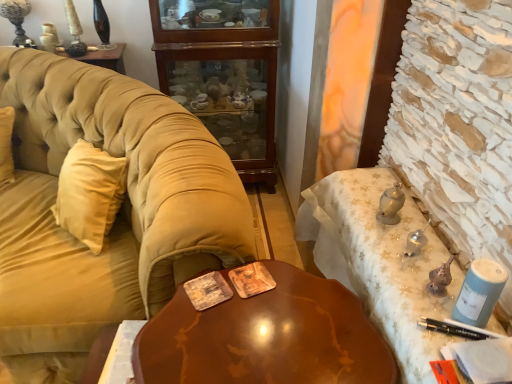
Question: From a real-world perspective, is velvet beige couch at left above or below glossy wood table at center?

Choices:
 (A) above
 (B) below

Answer: (A)

Question: Is velvet beige couch at left bigger or smaller than glossy wood table at center?

Choices:
 (A) small
 (B) big

Answer: (B)

Question: Which is nearer to the glossy wood table at center?

Choices:
 (A) velvet beige couch at left
 (B) metallic silver desk at right
 (C) mahogany wood cabinet at center

Answer: (B)

Question: Estimate the real-world distances between objects in this image. Which object is closer to the glossy wood table at center?

Choices:
 (A) mahogany wood cabinet at center
 (B) velvet beige couch at left
 (C) metallic silver desk at right

Answer: (C)